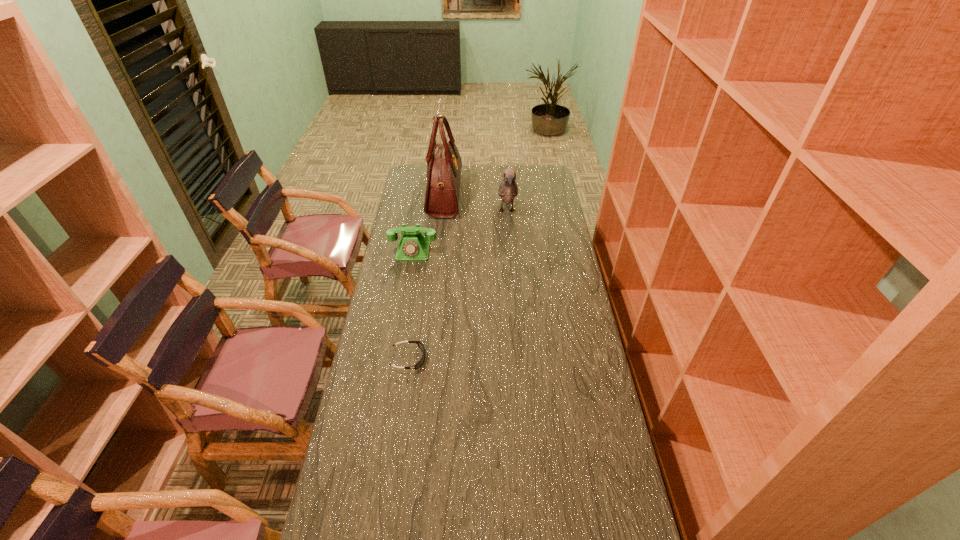
Find the location of a particular element. free area in between the tallest object and the parrot is located at coordinates (476, 203).

The image size is (960, 540). In order to click on free point between the handbag and the third farthest object in this screenshot , I will do `click(429, 223)`.

Identify the location of vacant point located between the tallest object and the second nearest object. The image size is (960, 540). (429, 223).

Identify the location of blank region between the handbag and the second shortest object. (429, 223).

The width and height of the screenshot is (960, 540). I want to click on vacant area that lies between the second shortest object and the nearest object, so click(411, 305).

Locate an element on the screen. This screenshot has width=960, height=540. vacant space that's between the handbag and the third shortest object is located at coordinates (476, 203).

At what (x,y) coordinates should I click in order to perform the action: click on free space between the second shortest object and the goggles. Please return your answer as a coordinate pair (x, y). This screenshot has width=960, height=540. Looking at the image, I should click on (411, 305).

The height and width of the screenshot is (540, 960). Identify the location of vacant space in between the third shortest object and the handbag. (476, 203).

Locate an element on the screen. object that stands as the third closest to the tallest object is located at coordinates (420, 345).

The height and width of the screenshot is (540, 960). Find the location of `object that is the second nearest to the parrot`. object that is the second nearest to the parrot is located at coordinates (413, 246).